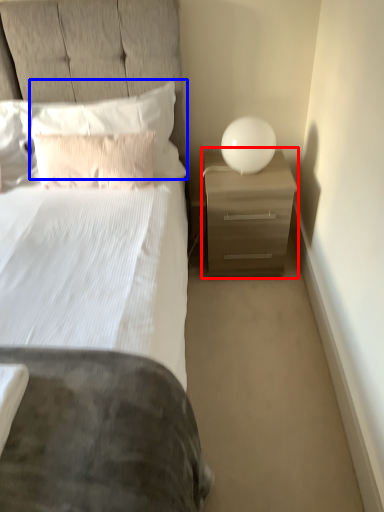
Question: Which object is further to the camera taking this photo, nightstand (highlighted by a red box) or pillow (highlighted by a blue box)?

Choices:
 (A) nightstand
 (B) pillow

Answer: (A)